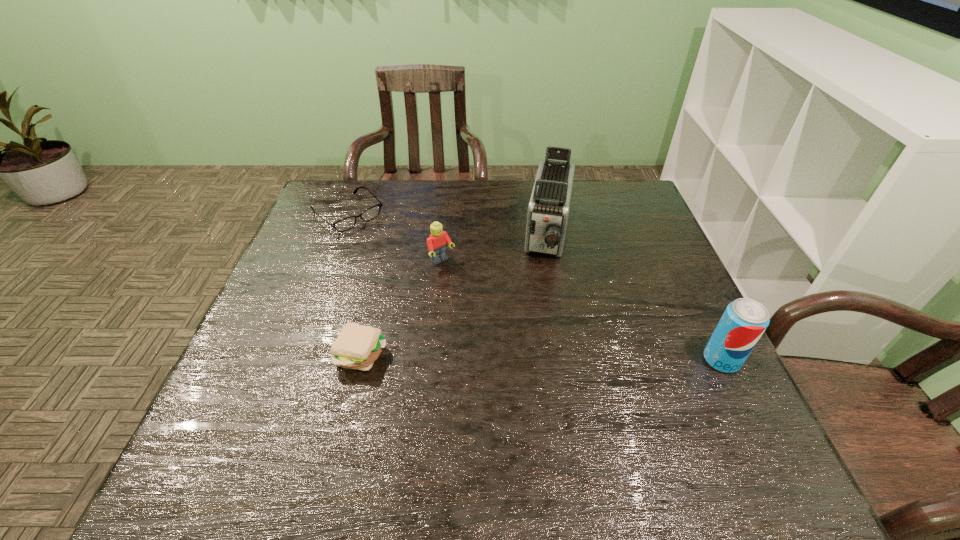
Locate an element on the screen. The image size is (960, 540). spectacles that is positioned at the far edge is located at coordinates (344, 224).

This screenshot has width=960, height=540. In order to click on object located at the left edge in this screenshot , I will do `click(344, 224)`.

This screenshot has width=960, height=540. What are the coordinates of `object at the right edge` in the screenshot? It's located at (742, 324).

Identify the location of object located in the far left corner section of the desktop. (344, 224).

In the image, there is a desktop. At what (x,y) coordinates should I click in order to perform the action: click on vacant space at the far edge. Please return your answer as a coordinate pair (x, y). The height and width of the screenshot is (540, 960). Looking at the image, I should click on (480, 194).

Where is `free point at the near edge`? This screenshot has height=540, width=960. free point at the near edge is located at coordinates (540, 393).

In the image, there is a desktop. Where is `vacant space at the left edge`? The image size is (960, 540). vacant space at the left edge is located at coordinates (260, 352).

Locate an element on the screen. free space at the right edge of the desktop is located at coordinates (625, 294).

Identify the location of vacant space at the far left corner of the desktop. (342, 186).

In the image, there is a desktop. Identify the location of vacant region at the far right corner. (603, 188).